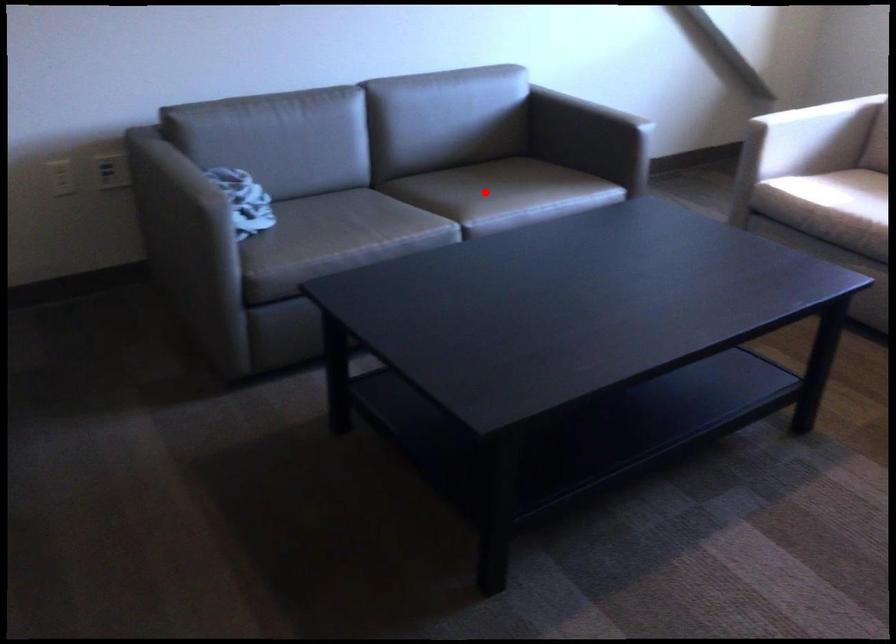
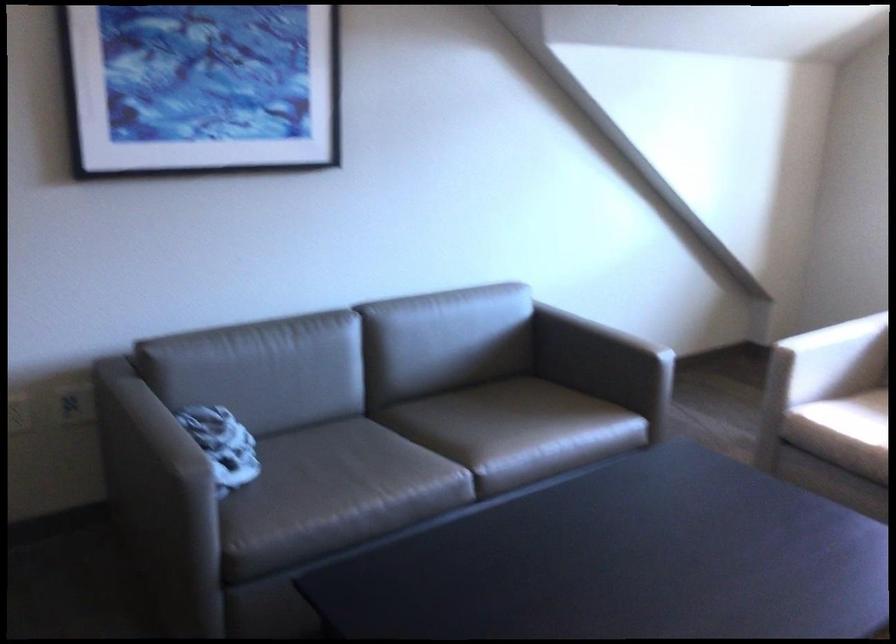
Question: A red point is marked in image1. In image2, is the corresponding 3D point closer to the camera or farther? Reply with the corresponding letter.

Choices:
 (A) The corresponding 3D point is closer.
 (B) The corresponding 3D point is farther.

Answer: (A)